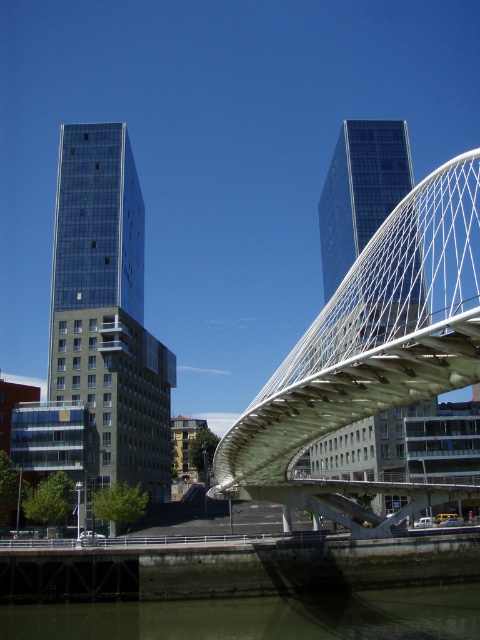
Question: Does glassy blue building at center appear over greenish water at lower center?

Choices:
 (A) yes
 (B) no

Answer: (A)

Question: Is glassy blue building at center above greenish water at lower center?

Choices:
 (A) yes
 (B) no

Answer: (A)

Question: Is glassy blue building at center to the left of greenish water at lower center from the viewer's perspective?

Choices:
 (A) no
 (B) yes

Answer: (B)

Question: Which object appears farthest from the camera in this image?

Choices:
 (A) translucent glass bridge at center
 (B) glassy blue building at center

Answer: (B)

Question: Which of the following is the farthest from the observer?

Choices:
 (A) (395, 436)
 (B) (295, 595)
 (C) (164, 381)

Answer: (C)

Question: Which of the following is the farthest from the observer?

Choices:
 (A) translucent glass bridge at center
 (B) greenish water at lower center
 (C) glassy blue building at center
 (D) glassy blue skyscraper at center

Answer: (C)